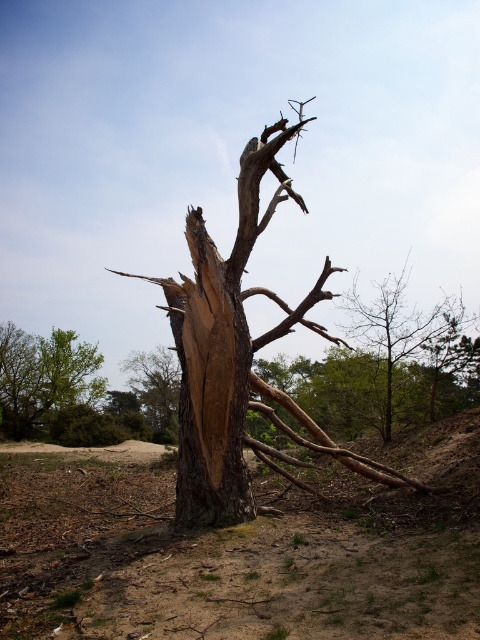
Who is taller, green leafy tree at lower left or brown rough bark tree at center?

Standing taller between the two is brown rough bark tree at center.

Is point (8, 348) farther from camera compared to point (155, 352)?

That is True.

This screenshot has height=640, width=480. In order to click on green leafy tree at lower left in this screenshot , I will do `click(44, 376)`.

Which of these two, brown sandy soil at center or dark brown wood at center, stands taller?

dark brown wood at center

Locate an element on the screen. Image resolution: width=480 pixels, height=640 pixels. brown sandy soil at center is located at coordinates (240, 552).

Is point (176, 636) positioned in front of point (393, 288)?

Yes, it is in front of point (393, 288).

Between brown sandy soil at center and smooth brown tree trunk at center, which one is positioned lower?

Positioned lower is brown sandy soil at center.

This screenshot has width=480, height=640. I want to click on brown sandy soil at center, so click(240, 552).

Identify the location of brown sandy soil at center. (240, 552).